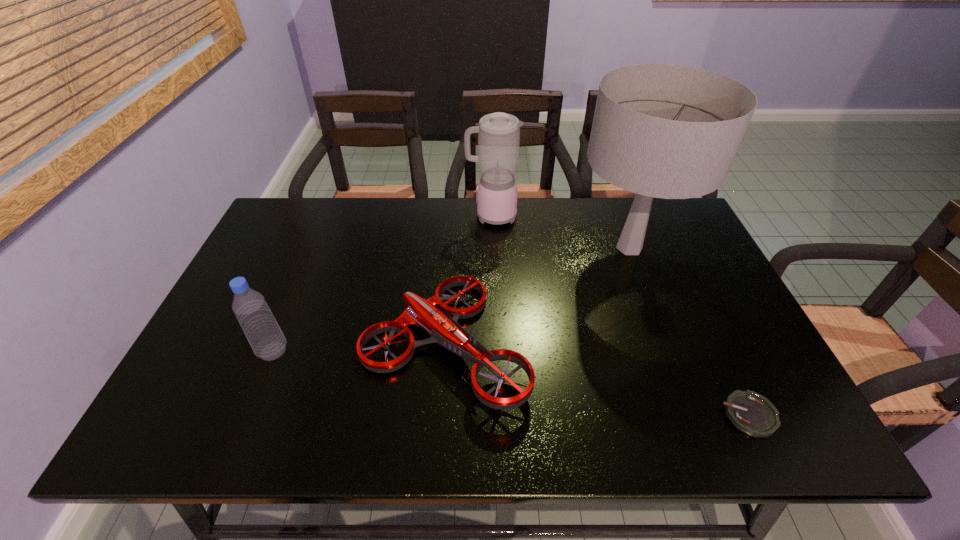
The image size is (960, 540). Find the location of `lampshade positioned at the right edge`. lampshade positioned at the right edge is located at coordinates (667, 131).

Find the location of a particular element. ashtray present at the right edge is located at coordinates (750, 412).

What are the coordinates of `object situated at the far right corner` in the screenshot? It's located at [667, 131].

You are a GUI agent. You are given a task and a screenshot of the screen. Output one action in this format:
    pyautogui.click(x=<x>, y=<y>)
    Task: Click on the object positioned at the near right corner
    Image resolution: width=960 pixels, height=540 pixels.
    Given the screenshot: What is the action you would take?
    pyautogui.click(x=750, y=412)

Image resolution: width=960 pixels, height=540 pixels. In the image, there is a desktop. What are the coordinates of `vacant space at the far edge` in the screenshot? It's located at (416, 222).

Locate an element on the screen. vacant region at the near edge of the desktop is located at coordinates (351, 443).

You are a GUI agent. You are given a task and a screenshot of the screen. Output one action in this format:
    pyautogui.click(x=<x>, y=<y>)
    Task: Click on the vacant space at the left edge
    The width and height of the screenshot is (960, 540).
    Given the screenshot: What is the action you would take?
    pyautogui.click(x=252, y=377)

Find the location of `vacant space at the right edge of the desktop`. vacant space at the right edge of the desktop is located at coordinates (724, 350).

This screenshot has height=540, width=960. I want to click on vacant position at the far left corner of the desktop, so click(x=277, y=218).

In the image, there is a desktop. Identify the location of vacant space at the far right corner. (678, 232).